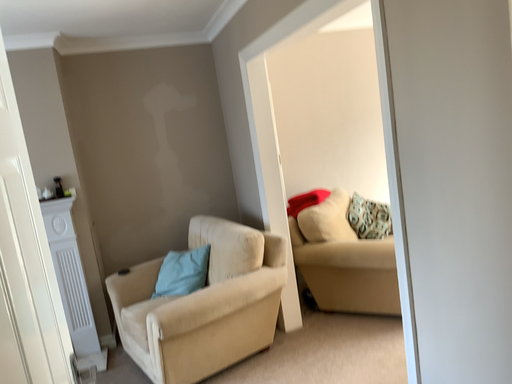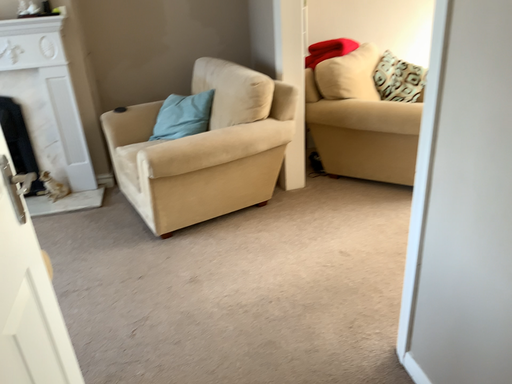
Question: How did the camera likely rotate when shooting the video?

Choices:
 (A) rotated upward
 (B) rotated downward

Answer: (B)